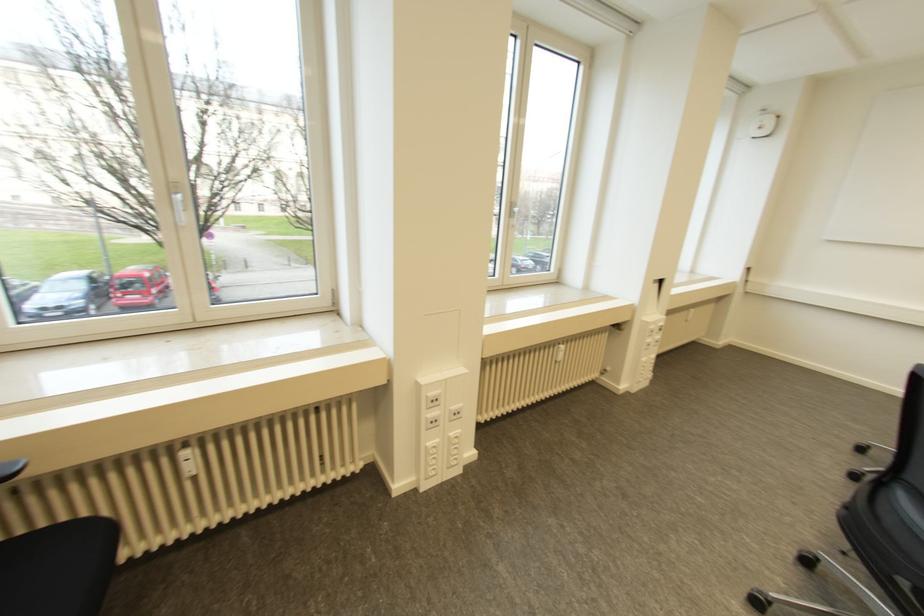
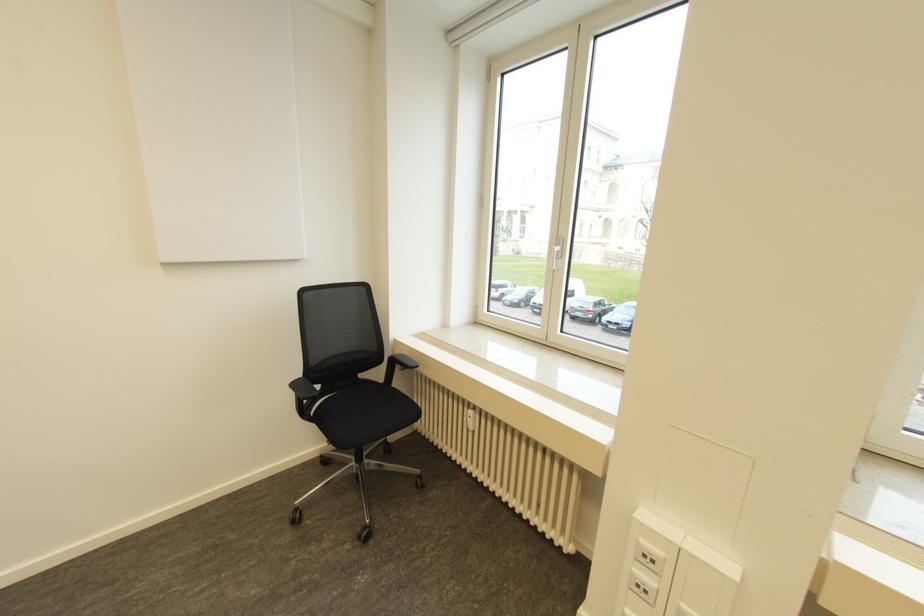
Where in the second image is the point corresponding to point (176, 196) from the first image?

(557, 248)